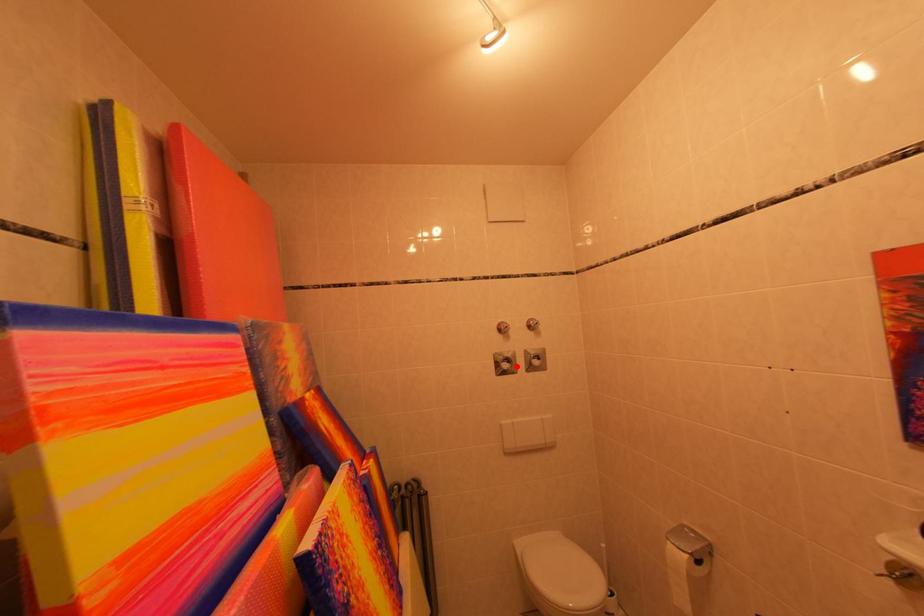
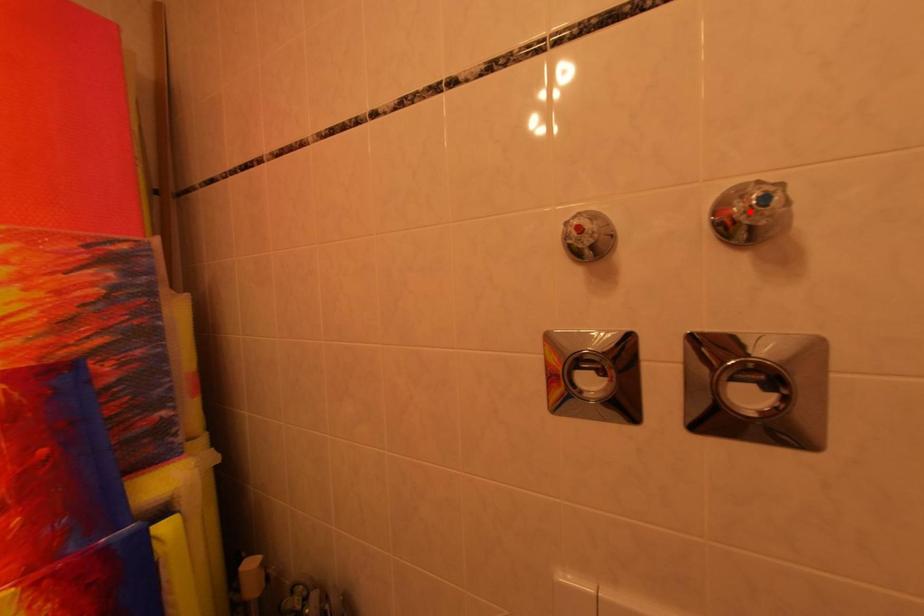
I am providing you with two images of the same scene from different viewpoints. A red point is marked on the first image and another point is marked on the second image. Does the point marked in image1 correspond to the same location as the one in image2?

No